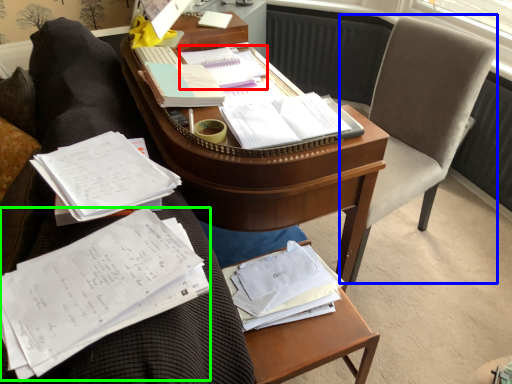
Question: Which object is the closest to the book (highlighted by a red box)? Choose among these: swivel chair (highlighted by a blue box) or document (highlighted by a green box).

Choices:
 (A) swivel chair
 (B) document

Answer: (A)